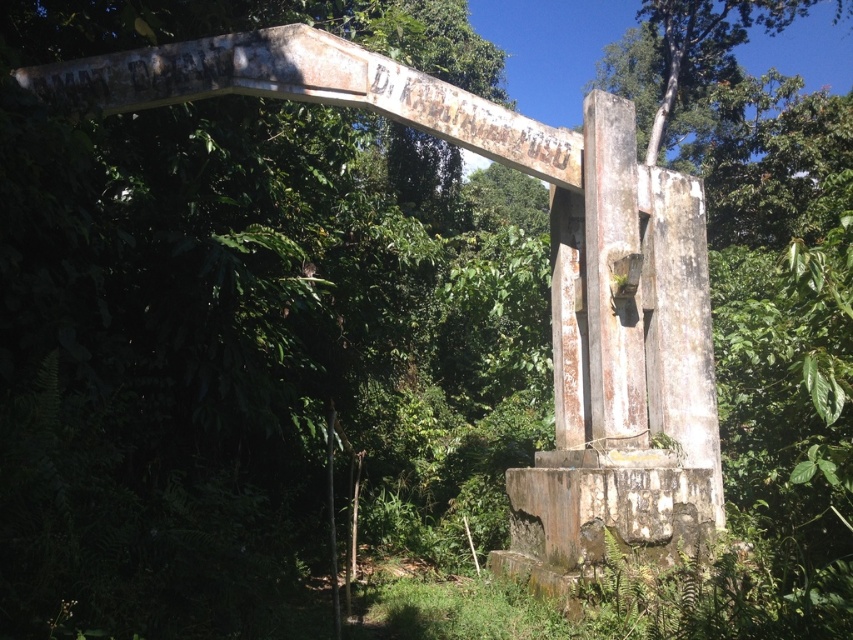
Is rusty concrete monument at center smaller than green leafy tree at upper center?

Incorrect, rusty concrete monument at center is not smaller in size than green leafy tree at upper center.

Does point (531, 588) lie in front of point (665, 24)?

Yes.

Between point (590, 154) and point (733, 10), which one is positioned in front?

Positioned in front is point (590, 154).

You are a GUI agent. You are given a task and a screenshot of the screen. Output one action in this format:
    pyautogui.click(x=<x>, y=<y>)
    Task: Click on the rusty concrete monument at center
    This screenshot has height=640, width=853.
    Given the screenshot: What is the action you would take?
    pyautogui.click(x=621, y=369)